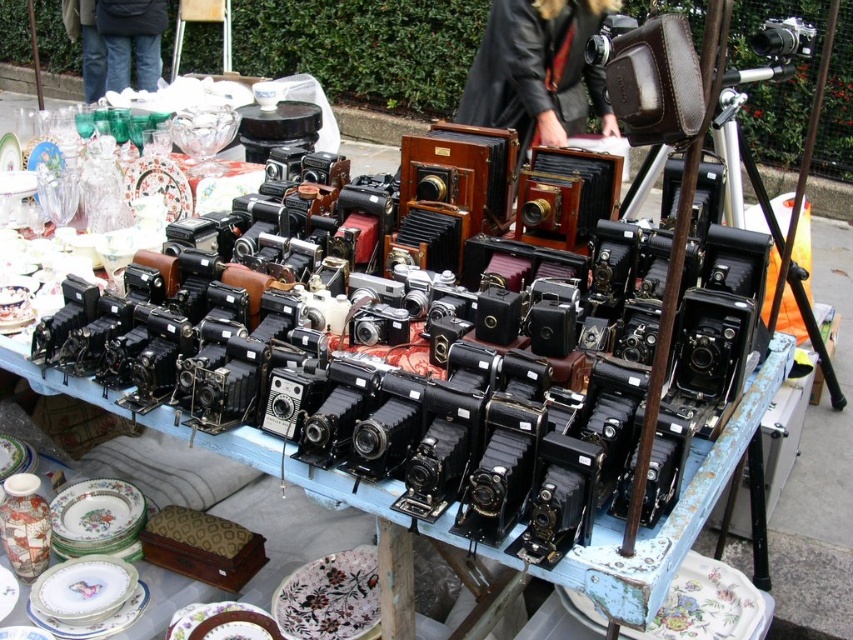
Question: Is brown leather camera case at center smaller than metallic silver camera at upper right?

Choices:
 (A) no
 (B) yes

Answer: (A)

Question: Does brown leather camera case at center have a larger size compared to metallic silver camera at upper right?

Choices:
 (A) yes
 (B) no

Answer: (A)

Question: Which of the following is the closest to the observer?

Choices:
 (A) (506, 1)
 (B) (770, 36)

Answer: (B)

Question: Can you confirm if brown leather camera case at center is positioned to the right of metallic silver camera at upper right?

Choices:
 (A) no
 (B) yes

Answer: (A)